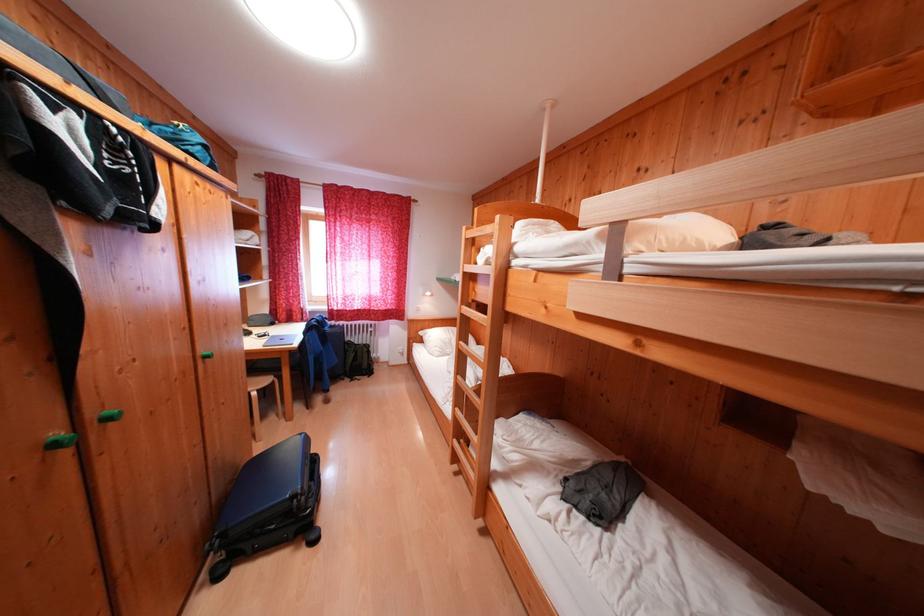
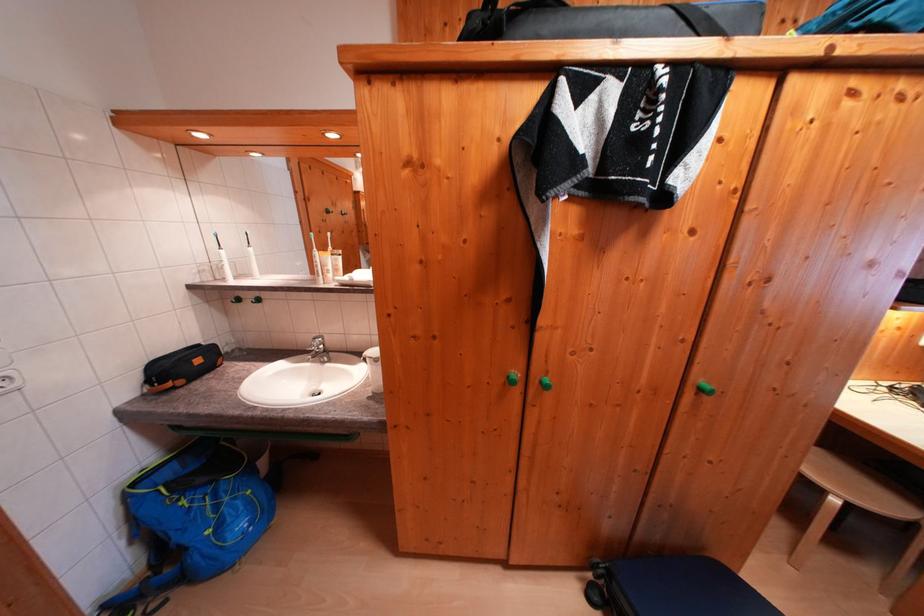
In the second image, find the point that corresponds to (262,398) in the first image.

(843, 505)